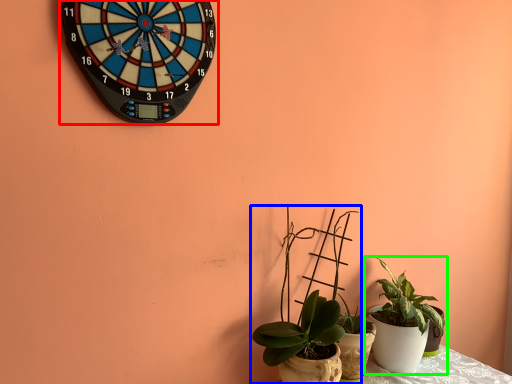
Question: Considering the real-world distances, which object is closest to wall clock (highlighted by a red box)? houseplant (highlighted by a blue box) or houseplant (highlighted by a green box).

Choices:
 (A) houseplant
 (B) houseplant

Answer: (A)